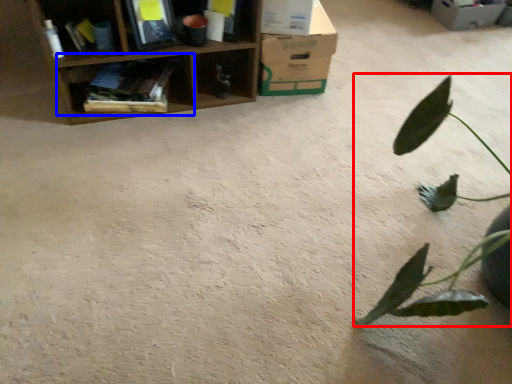
Question: Which of the following is the closest to the observer, houseplant (highlighted by a red box) or shelf (highlighted by a blue box)?

Choices:
 (A) houseplant
 (B) shelf

Answer: (A)